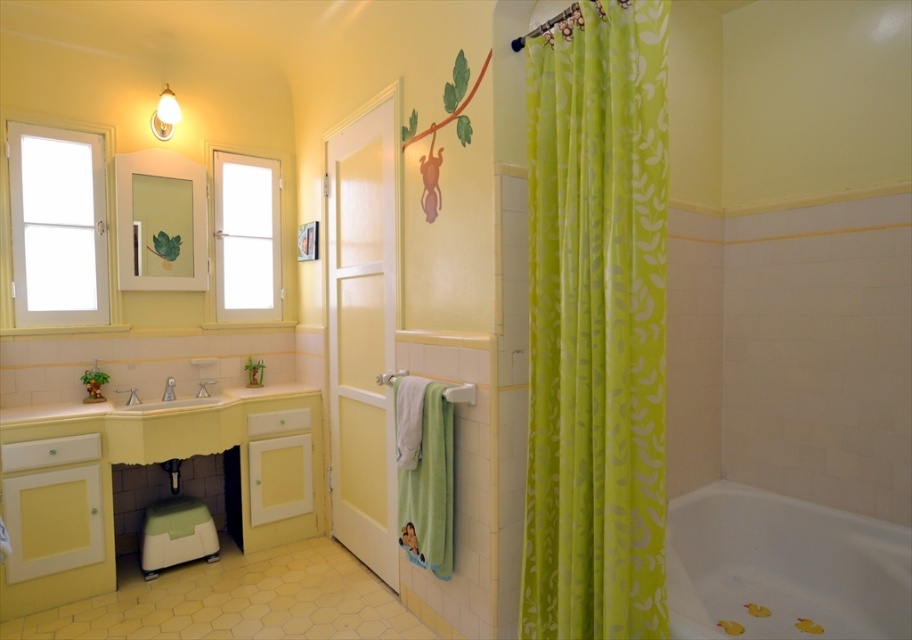
Does lime green fabric at right appear on the right side of brushed metal faucet at sink left?

Correct, you'll find lime green fabric at right to the right of brushed metal faucet at sink left.

Who is more forward, (640,108) or (167,392)?

Point (640,108)

In order to click on lime green fabric at right in this screenshot , I will do `click(596, 326)`.

Which is more to the right, white glossy bathtub at lower right or transparent glass door at center?

From the viewer's perspective, white glossy bathtub at lower right appears more on the right side.

The width and height of the screenshot is (912, 640). What do you see at coordinates (782, 568) in the screenshot?
I see `white glossy bathtub at lower right` at bounding box center [782, 568].

Who is more distant from viewer, (804,630) or (247,312)?

Point (247,312)

At what (x,y) coordinates should I click in order to perform the action: click on white glossy bathtub at lower right. Please return your answer as a coordinate pair (x, y). Looking at the image, I should click on (782, 568).

Who is lower down, white plastic towel bar at center or white matte towel bar at center?

Positioned lower is white plastic towel bar at center.

Is white plastic towel bar at center closer to camera compared to white matte towel bar at center?

Yes, white plastic towel bar at center is closer to the viewer.

Is point (451, 401) closer to viewer compared to point (400, 371)?

Yes, it is.

Identify the location of white plastic towel bar at center. (460, 394).